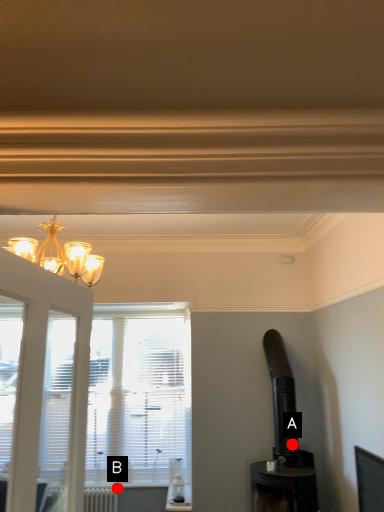
Question: Two points are circled on the image, labeled by A and B beside each circle. Among these points, which one is nearest to the camera?

Choices:
 (A) A is closer
 (B) B is closer

Answer: (A)